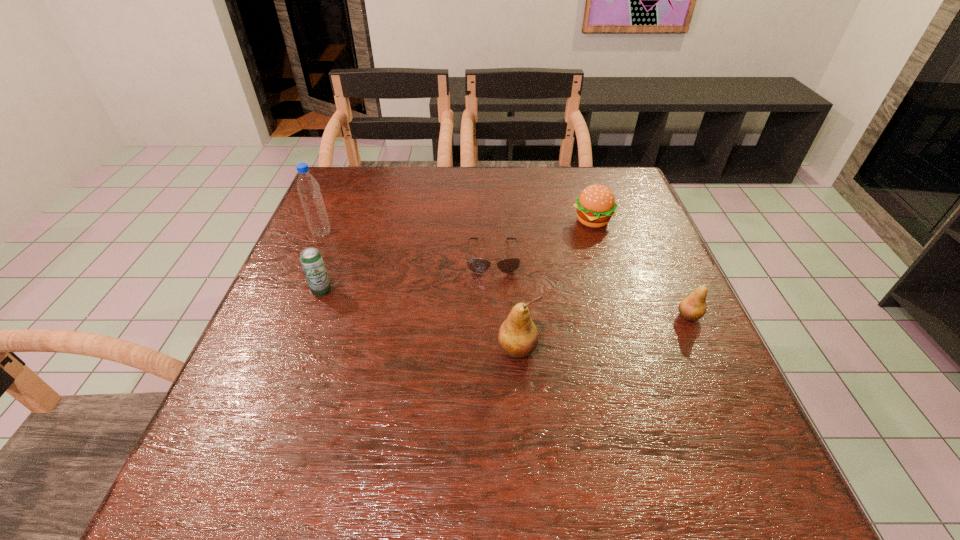
The height and width of the screenshot is (540, 960). In order to click on free space located on the front of the fifth shortest object in this screenshot , I will do `click(521, 408)`.

Image resolution: width=960 pixels, height=540 pixels. Find the location of `free space located 0.090m on the back of the fifth farthest object`. free space located 0.090m on the back of the fifth farthest object is located at coordinates (671, 279).

Find the location of `free region located 0.060m on the front of the water bottle`. free region located 0.060m on the front of the water bottle is located at coordinates (313, 255).

The image size is (960, 540). I want to click on vacant space located 0.110m on the left of the second object from right to left, so click(x=531, y=221).

Where is `free space located 0.210m on the right of the third nearest object`? The image size is (960, 540). free space located 0.210m on the right of the third nearest object is located at coordinates (426, 291).

Locate an element on the screen. vacant position located on the front-facing side of the shortest object is located at coordinates (495, 322).

Where is `object positioned at the far edge`? object positioned at the far edge is located at coordinates (596, 204).

Identify the location of water bottle that is at the left edge. (308, 188).

Find the location of a particular element. The image size is (960, 540). beer can located at the left edge is located at coordinates (311, 259).

The height and width of the screenshot is (540, 960). In order to click on pear that is at the right edge in this screenshot , I will do `click(693, 307)`.